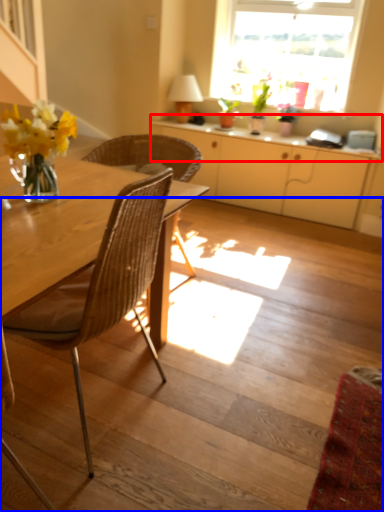
Question: Which point is further to the camera, counter top (highlighted by a red box) or stairs (highlighted by a blue box)?

Choices:
 (A) counter top
 (B) stairs

Answer: (A)